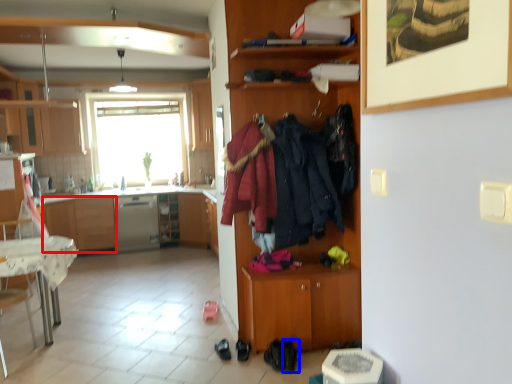
Question: Which object appears farthest to the camera in this image, cabinetry (highlighted by a red box) or footwear (highlighted by a blue box)?

Choices:
 (A) cabinetry
 (B) footwear

Answer: (A)